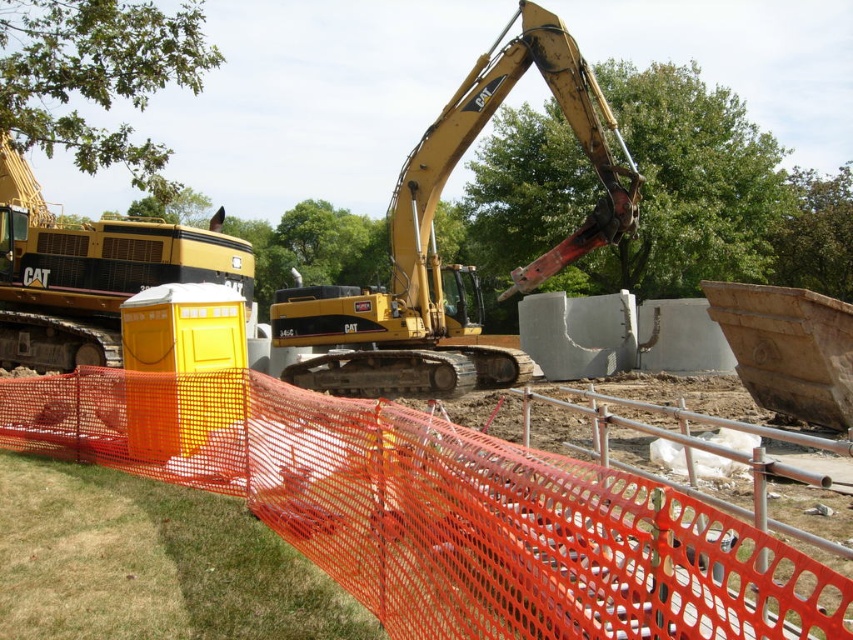
You are a construction worker standing at the camera position. You need to cross to the other side of the orange mesh fence at center. The fence is 1.8 meters wide. Can you walk around it without going through the fence?

The orange mesh fence at center is 3.52 meters from camera. Since the fence is only 1.8 meters wide, you can walk around it on either side as long as there is clear space beyond the fence perimeter.

You are a construction worker who needs to move a 2m wide equipment through the gap between the orange mesh fence at center and the yellow metallic excavator at center. Can the equipment pass through the gap?

The orange mesh fence at center has a lesser width compared to yellow metallic excavator at center, so the gap between them is wider than the equipment. The 2m wide equipment can pass through the gap.